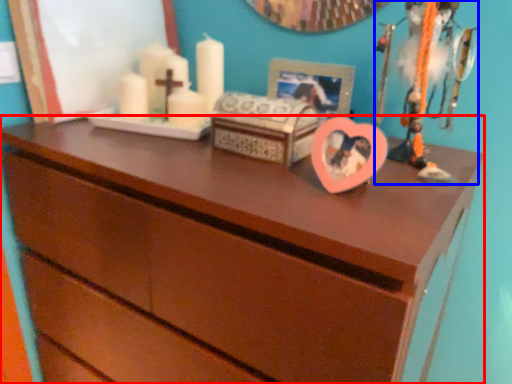
Question: Which of the following is the closest to the observer, chest of drawers (highlighted by a red box) or toy (highlighted by a blue box)?

Choices:
 (A) chest of drawers
 (B) toy

Answer: (A)